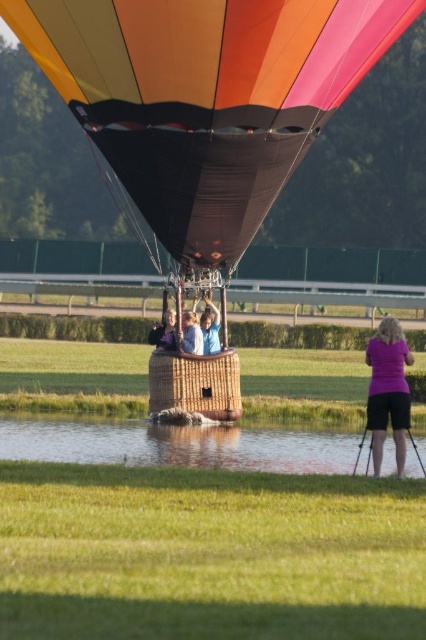
Question: Can you confirm if multicolored wicker basket at center is bigger than woven brown basket at center?

Choices:
 (A) no
 (B) yes

Answer: (B)

Question: Is multicolored wicker basket at center above matte blue shirt at center?

Choices:
 (A) no
 (B) yes

Answer: (B)

Question: Which point is farther from the camera taking this photo?

Choices:
 (A) (169, 308)
 (B) (264, 468)

Answer: (A)

Question: Is clear water at lower center above matte blue shirt at center?

Choices:
 (A) yes
 (B) no

Answer: (B)

Question: Which object appears closest to the camera in this image?

Choices:
 (A) clear water at lower center
 (B) woven brown basket at center
 (C) multicolored wicker basket at center

Answer: (C)

Question: Which of these objects is positioned farthest from the woven brown basket at center?

Choices:
 (A) light blue fabric at center
 (B) clear water at lower center
 (C) matte blue shirt at center
 (D) multicolored wicker basket at center

Answer: (D)